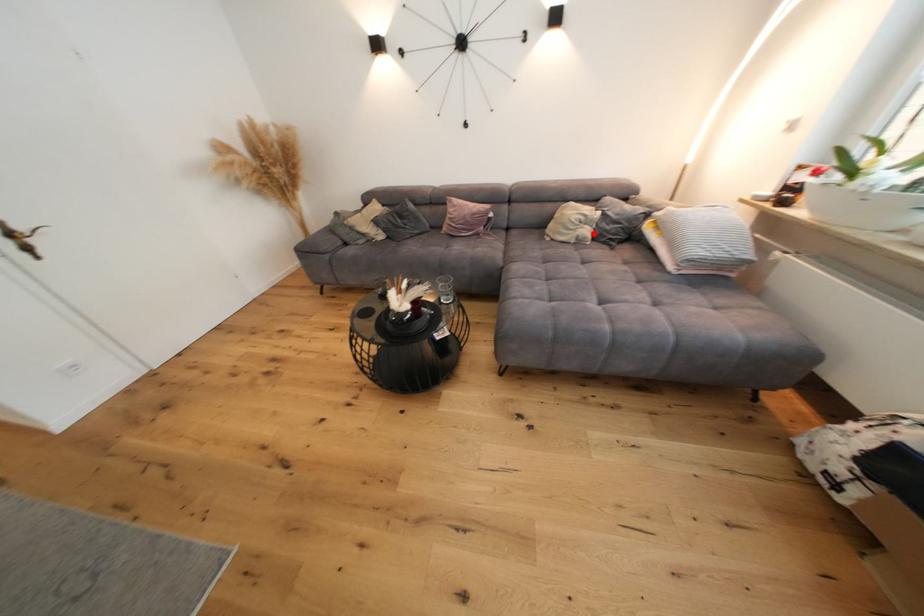
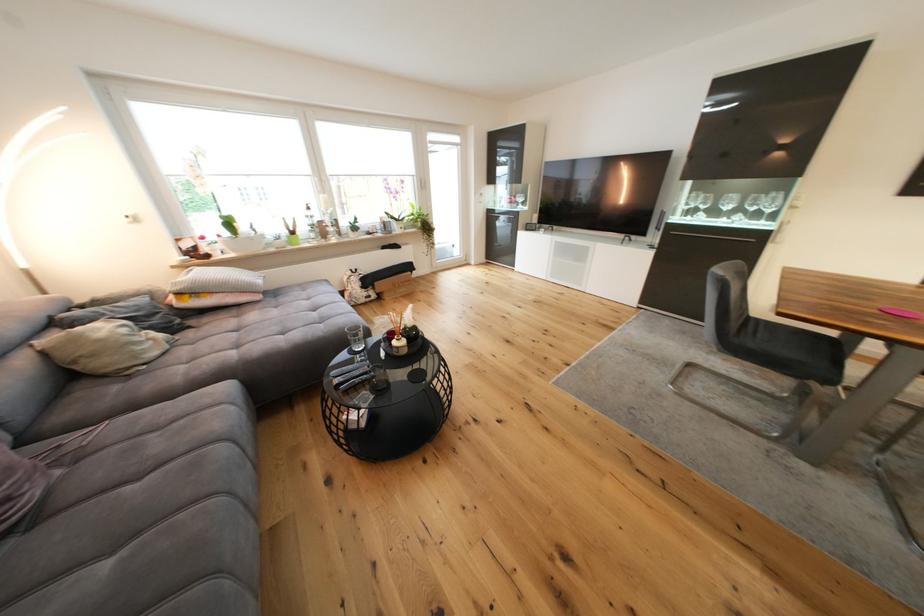
Where in the second image is the point corresponding to the highlighted location from the first image?

(161, 336)